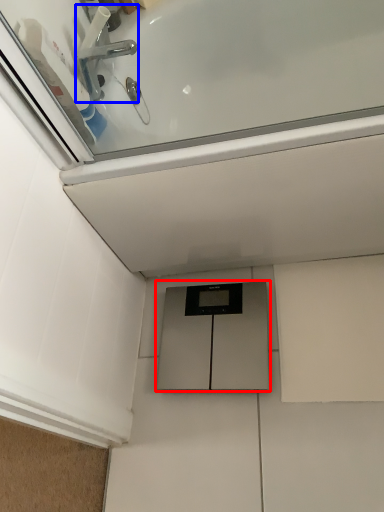
Question: Which object appears closest to the camera in this image, cabinetry (highlighted by a red box) or tap (highlighted by a blue box)?

Choices:
 (A) cabinetry
 (B) tap

Answer: (B)